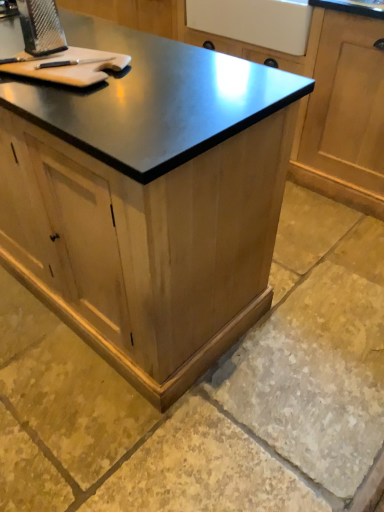
Question: Is metallic grater at upper left oriented away from wooden cabinet at center, marked as the 1th cabinetry in a back-to-front arrangement?

Choices:
 (A) yes
 (B) no

Answer: (B)

Question: Considering the relative sizes of metallic grater at upper left and wooden cabinet at center, arranged as the second cabinetry when viewed from the front, in the image provided, is metallic grater at upper left shorter than wooden cabinet at center, arranged as the second cabinetry when viewed from the front,?

Choices:
 (A) yes
 (B) no

Answer: (A)

Question: Is metallic grater at upper left not near wooden cabinet at center, arranged as the second cabinetry when viewed from the front?

Choices:
 (A) yes
 (B) no

Answer: (A)

Question: Considering the relative sizes of metallic grater at upper left and wooden cabinet at center, arranged as the second cabinetry when viewed from the front, in the image provided, is metallic grater at upper left thinner than wooden cabinet at center, arranged as the second cabinetry when viewed from the front,?

Choices:
 (A) yes
 (B) no

Answer: (A)

Question: Is metallic grater at upper left smaller than wooden cabinet at center, marked as the 1th cabinetry in a back-to-front arrangement?

Choices:
 (A) yes
 (B) no

Answer: (A)

Question: Could wooden cabinet at center, arranged as the second cabinetry when viewed from the front, be considered to be inside metallic grater at upper left?

Choices:
 (A) yes
 (B) no

Answer: (B)

Question: Can you see natural stone floor at lower center touching light brown wood cutting board at upper left?

Choices:
 (A) no
 (B) yes

Answer: (A)

Question: Considering the relative positions of natural stone floor at lower center and light brown wood cutting board at upper left in the image provided, is natural stone floor at lower center to the right of light brown wood cutting board at upper left from the viewer's perspective?

Choices:
 (A) no
 (B) yes

Answer: (B)

Question: Would you consider natural stone floor at lower center to be distant from light brown wood cutting board at upper left?

Choices:
 (A) yes
 (B) no

Answer: (A)

Question: Considering the relative sizes of natural stone floor at lower center and light brown wood cutting board at upper left in the image provided, is natural stone floor at lower center taller than light brown wood cutting board at upper left?

Choices:
 (A) no
 (B) yes

Answer: (B)

Question: Does natural stone floor at lower center have a greater width compared to light brown wood cutting board at upper left?

Choices:
 (A) no
 (B) yes

Answer: (B)

Question: Is natural stone floor at lower center smaller than light brown wood cutting board at upper left?

Choices:
 (A) yes
 (B) no

Answer: (B)

Question: From the image's perspective, is wooden cabinet at center, which ranks as the second cabinetry in back-to-front order, beneath wooden cabinet at center, arranged as the second cabinetry when viewed from the front?

Choices:
 (A) yes
 (B) no

Answer: (A)